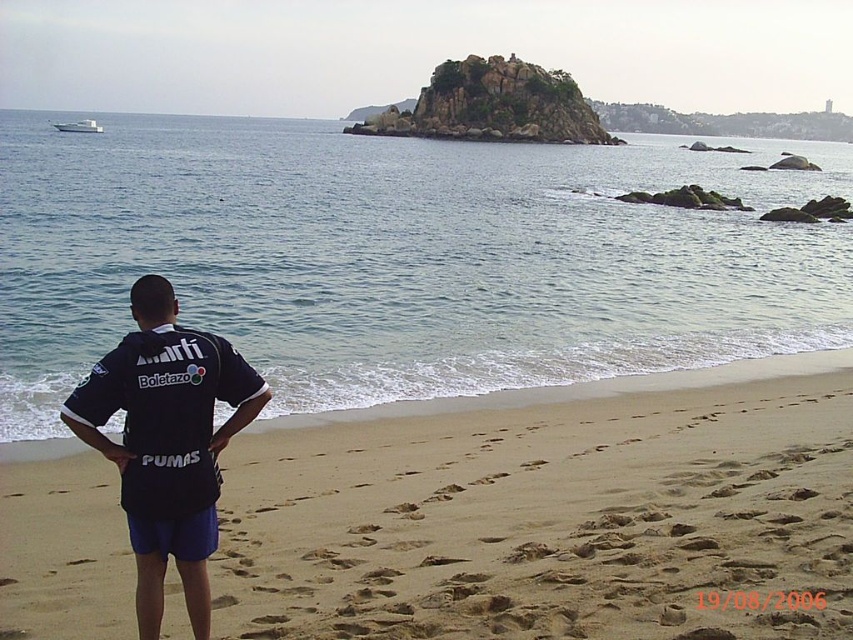
Is blue water at center to the right of sandy beach at lower left from the viewer's perspective?

In fact, blue water at center is to the left of sandy beach at lower left.

Does blue water at center have a greater width compared to sandy beach at lower left?

Yes.

You are a GUI agent. You are given a task and a screenshot of the screen. Output one action in this format:
    pyautogui.click(x=<x>, y=<y>)
    Task: Click on the blue water at center
    Image resolution: width=853 pixels, height=640 pixels.
    Given the screenshot: What is the action you would take?
    pyautogui.click(x=401, y=257)

Who is more forward, (569, 259) or (86, 387)?

Positioned in front is point (86, 387).

Between blue water at center and dark blue jersey at center, which one appears on the left side from the viewer's perspective?

From the viewer's perspective, blue water at center appears more on the left side.

Locate an element on the screen. blue water at center is located at coordinates (401, 257).

Does sandy beach at lower left have a lesser width compared to dark blue jersey at center?

No, sandy beach at lower left is not thinner than dark blue jersey at center.

Consider the image. Is sandy beach at lower left taller than dark blue jersey at center?

No.

Between point (744, 609) and point (152, 595), which one is positioned in front?

Point (152, 595) is more forward.

In order to click on sandy beach at lower left in this screenshot , I will do `click(552, 513)`.